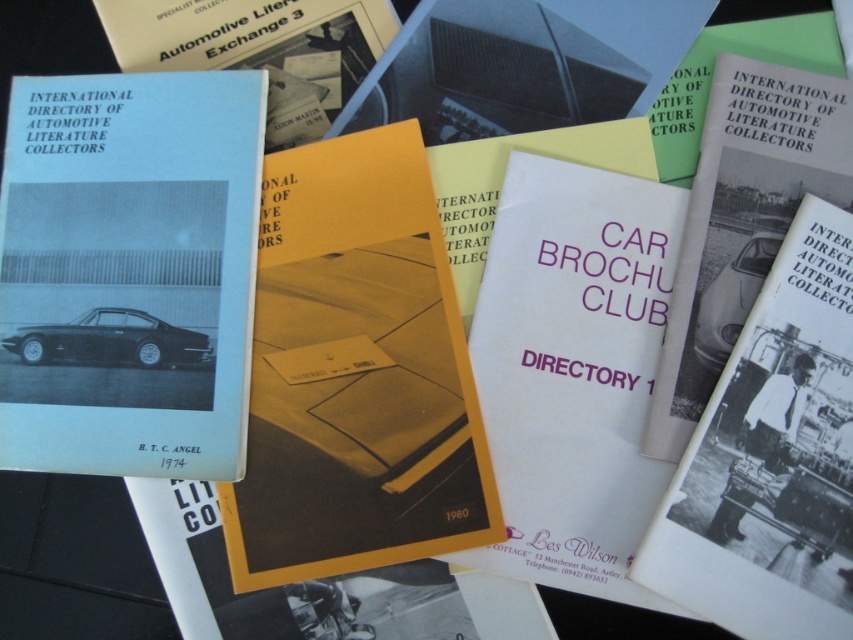
You are organizing a car enthusiast event and need to place the yellow paper brochure at center and the white glossy car at center on a shelf. According to the image, which one should you place on the left side of the shelf to maintain the original arrangement?

You should place the yellow paper brochure at center on the left side of the shelf because in the image, the yellow paper brochure at center is to the left of the white glossy car at center.